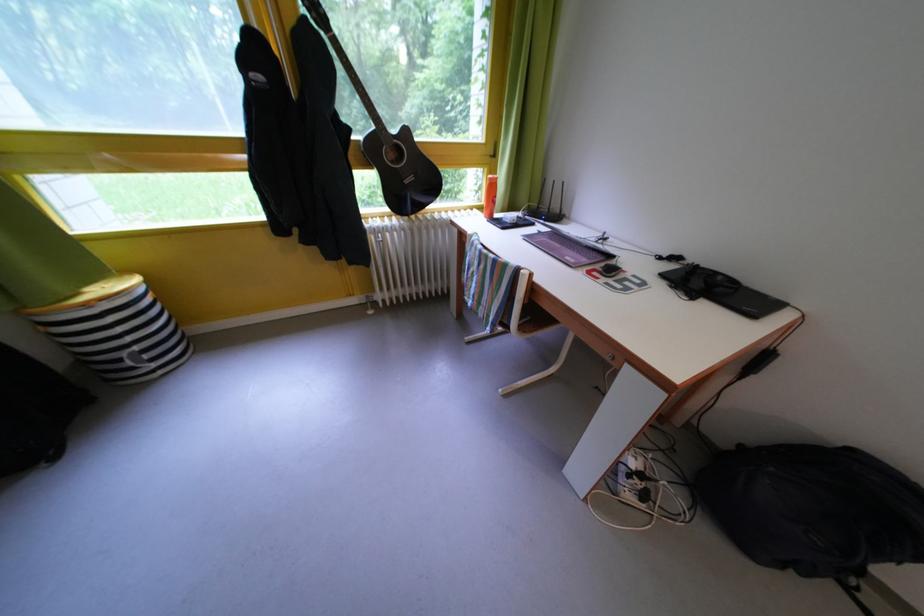
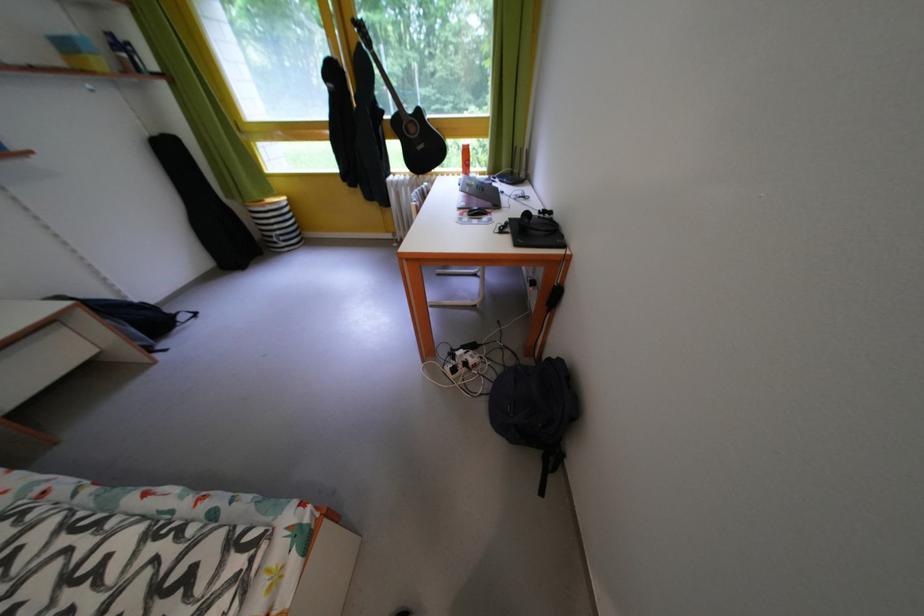
In the second image, find the point that corresponds to point 669,264 in the first image.

(550, 217)